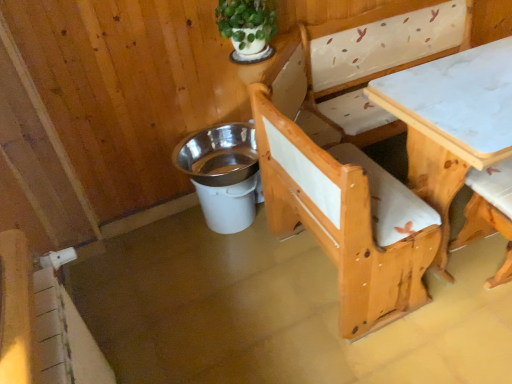
The height and width of the screenshot is (384, 512). Describe the element at coordinates (248, 28) in the screenshot. I see `green matte plant at upper center` at that location.

In order to click on green matte plant at upper center in this screenshot , I will do click(248, 28).

What do you see at coordinates (222, 174) in the screenshot?
I see `white plastic bucket at lower center` at bounding box center [222, 174].

The width and height of the screenshot is (512, 384). In order to click on white marble table at center in this screenshot , I will do `click(451, 122)`.

Which is in front, point (256, 189) or point (479, 211)?

The point (479, 211) is more forward.

From the image's perspective, is white plastic bucket at lower center over wooden chair at lower right?

Yes, from the image's perspective, white plastic bucket at lower center is above wooden chair at lower right.

Between white plastic bucket at lower center and wooden chair at lower right, which one has less height?

white plastic bucket at lower center is shorter.

Can you confirm if white plastic bucket at lower center is wider than wooden chair at lower right?

In fact, white plastic bucket at lower center might be narrower than wooden chair at lower right.

From a real-world perspective, between wooden chair at lower right and white plastic bucket at lower center, who is vertically lower?

white plastic bucket at lower center, from a real-world perspective.

Does wooden chair at lower right have a lesser height compared to white plastic bucket at lower center?

In fact, wooden chair at lower right may be taller than white plastic bucket at lower center.

At what (x,y) coordinates should I click in order to perform the action: click on trash bin/can below the wooden chair at lower right (from a real-world perspective). Please return your answer as a coordinate pair (x, y). Looking at the image, I should click on (222, 174).

Based on the photo, from a real-world perspective, is white marble table at center on top of white plastic bucket at lower center?

Yes, from a real-world perspective, white marble table at center is on top of white plastic bucket at lower center.

Which object is wider, white marble table at center or white plastic bucket at lower center?

white marble table at center.

Does point (392, 97) appear closer or farther from the camera than point (243, 199)?

Point (392, 97) appears to be closer to the viewer than point (243, 199).

You are a GUI agent. You are given a task and a screenshot of the screen. Output one action in this format:
    pyautogui.click(x=<x>, y=<y>)
    Task: Click on the table in front of the green matte plant at upper center
    
    Given the screenshot: What is the action you would take?
    pyautogui.click(x=451, y=122)

Is white marble table at center not inside green matte plant at upper center?

white marble table at center lies outside green matte plant at upper center's area.

From a real-world perspective, is white marble table at center positioned under green matte plant at upper center based on gravity?

Yes, from a real-world perspective, white marble table at center is under green matte plant at upper center.

Does white marble table at center turn towards green matte plant at upper center?

No, white marble table at center is not turned towards green matte plant at upper center.

From a real-world perspective, does green matte plant at upper center sit lower than wooden chair at lower right?

No, from a real-world perspective, green matte plant at upper center is not below wooden chair at lower right.

In order to click on houseplant on the left of wooden chair at lower right in this screenshot , I will do click(248, 28).

Is green matte plant at upper center in front of or behind wooden chair at lower right in the image?

green matte plant at upper center is positioned farther from the viewer than wooden chair at lower right.

Can you confirm if green matte plant at upper center is thinner than wooden chair at lower right?

Yes.

From a real-world perspective, is white marble table at center physically located above or below wooden chair at lower right?

white marble table at center is above wooden chair at lower right.

Where is `table located above the wooden chair at lower right (from the image's perspective)`? Image resolution: width=512 pixels, height=384 pixels. table located above the wooden chair at lower right (from the image's perspective) is located at coordinates (451, 122).

Can you confirm if white marble table at center is taller than wooden chair at lower right?

Yes.

In the image, is white marble table at center on the left side or the right side of wooden chair at lower right?

From the image, it's evident that white marble table at center is to the right of wooden chair at lower right.

Are green matte plant at upper center and white plastic bucket at lower center far apart?

No, green matte plant at upper center is not far from white plastic bucket at lower center.

Is green matte plant at upper center further to camera compared to white plastic bucket at lower center?

No, the depth of green matte plant at upper center is less than that of white plastic bucket at lower center.

From a real-world perspective, is green matte plant at upper center above or below white plastic bucket at lower center?

green matte plant at upper center is situated higher than white plastic bucket at lower center in the real world.

Measure the distance between green matte plant at upper center and white plastic bucket at lower center.

green matte plant at upper center is 23.51 inches from white plastic bucket at lower center.

The image size is (512, 384). I want to click on trash bin/can above the wooden chair at lower right (from the image's perspective), so click(222, 174).

The image size is (512, 384). Find the location of `trash bin/can directly beneath the wooden chair at lower right (from a real-world perspective)`. trash bin/can directly beneath the wooden chair at lower right (from a real-world perspective) is located at coordinates 222,174.

From the image, which object appears to be farther from green matte plant at upper center, wooden chair at lower right or white plastic bucket at lower center?

wooden chair at lower right.

Consider the image. Based on their spatial positions, is green matte plant at upper center or white marble table at center closer to white plastic bucket at lower center?

green matte plant at upper center is closer to white plastic bucket at lower center.

Which object lies nearer to the anchor point white plastic bucket at lower center, wooden chair at lower right or white marble table at center?

white marble table at center is closer to white plastic bucket at lower center.

Estimate the real-world distances between objects in this image. Which object is closer to wooden chair at lower right, white marble table at center or white plastic bucket at lower center?

white marble table at center lies closer to wooden chair at lower right than the other object.

Consider the image. Based on their spatial positions, is wooden chair at lower right or white marble table at center further from green matte plant at upper center?

wooden chair at lower right is further to green matte plant at upper center.

Which object lies further to the anchor point green matte plant at upper center, white plastic bucket at lower center or white marble table at center?

The object further to green matte plant at upper center is white marble table at center.

From the image, which object appears to be farther from white marble table at center, wooden chair at lower right or white plastic bucket at lower center?

white plastic bucket at lower center.

Based on their spatial positions, is white plastic bucket at lower center or white marble table at center further from wooden chair at lower right?

Among the two, white plastic bucket at lower center is located further to wooden chair at lower right.

The height and width of the screenshot is (384, 512). I want to click on houseplant between white plastic bucket at lower center and wooden chair at lower right in the horizontal direction, so click(x=248, y=28).

Locate an element on the screen. chair between white plastic bucket at lower center and white marble table at center in the horizontal direction is located at coordinates (489, 213).

You are a GUI agent. You are given a task and a screenshot of the screen. Output one action in this format:
    pyautogui.click(x=<x>, y=<y>)
    Task: Click on the houseplant between white plastic bucket at lower center and white marble table at center from left to right
    
    Given the screenshot: What is the action you would take?
    pyautogui.click(x=248, y=28)

Find the location of a particular element. The width and height of the screenshot is (512, 384). chair between green matte plant at upper center and white marble table at center is located at coordinates (489, 213).